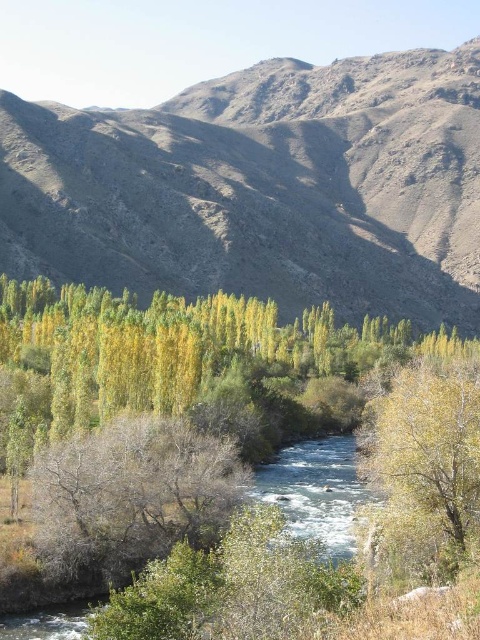
Is rugged brown mountain at center positioned at the back of bare branches at center?

Yes, rugged brown mountain at center is further from the viewer.

Based on the photo, is rugged brown mountain at center positioned in front of bare branches at center?

No, rugged brown mountain at center is behind bare branches at center.

I want to click on rugged brown mountain at center, so click(263, 188).

Between yellow-green leafy tree at center-right and clear water at center, which one appears on the left side from the viewer's perspective?

From the viewer's perspective, clear water at center appears more on the left side.

Is yellow-green leafy tree at center-right bigger than clear water at center?

Correct, yellow-green leafy tree at center-right is larger in size than clear water at center.

Where is `yellow-green leafy tree at center-right`? yellow-green leafy tree at center-right is located at coordinates (425, 472).

Where is `yellow-green leafy tree at center-right`? The image size is (480, 640). yellow-green leafy tree at center-right is located at coordinates (425, 472).

Is point (187, 145) positioned behind point (478, 417)?

Yes.

Is rugged brown mountain at center above yellow-green leafy tree at center-right?

Indeed, rugged brown mountain at center is positioned over yellow-green leafy tree at center-right.

Does point (454, 262) come closer to viewer compared to point (395, 410)?

No, it is behind (395, 410).

Where is `rugged brown mountain at center`? The width and height of the screenshot is (480, 640). rugged brown mountain at center is located at coordinates (263, 188).